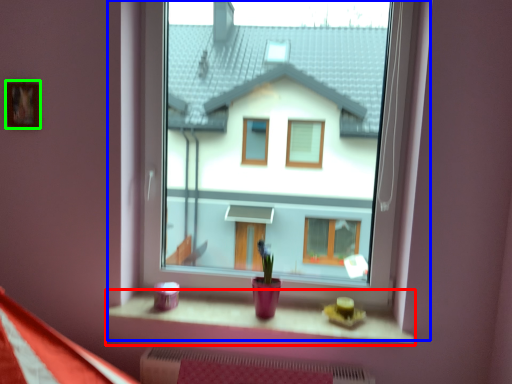
Question: Considering the real-world distances, which object is farthest from window sill (highlighted by a red box)? window (highlighted by a blue box) or picture frame (highlighted by a green box)?

Choices:
 (A) window
 (B) picture frame

Answer: (A)